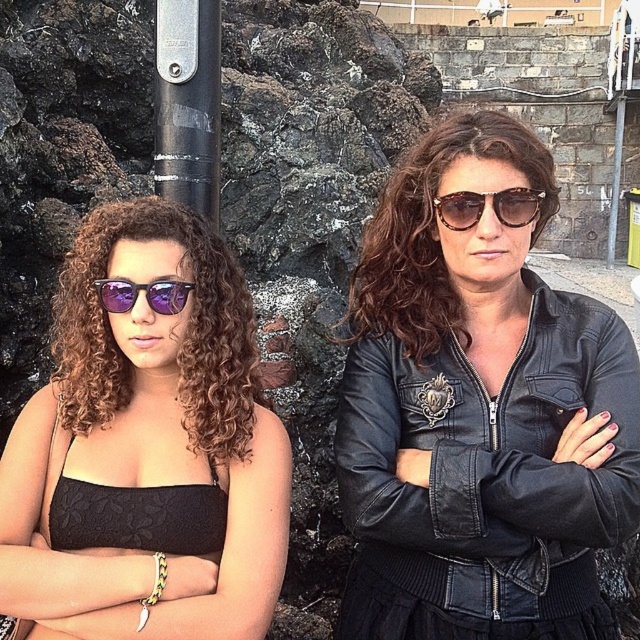
Describe the element at coordinates (433, 232) in the screenshot. I see `leather jacket at center` at that location.

Is leather jacket at center in front of purple reflective sunglasses at left?

No, leather jacket at center is behind purple reflective sunglasses at left.

Does point (394, 305) come farther from viewer compared to point (118, 291)?

Yes, it is.

In order to click on leather jacket at center in this screenshot , I will do `click(433, 232)`.

Between black leather jacket at center and purple reflective sunglasses at left, which one is positioned higher?

Positioned higher is purple reflective sunglasses at left.

Is point (524, 474) more distant than point (188, 285)?

No, (524, 474) is closer to viewer.

Does point (444, 609) lie in front of point (128, 280)?

No, it is behind (128, 280).

Where is `black leather jacket at center`? black leather jacket at center is located at coordinates (486, 481).

Measure the distance between matte black top at center and purple reflective sunglasses at left.

matte black top at center and purple reflective sunglasses at left are 30.48 inches apart.

Looking at this image, does matte black top at center come behind purple reflective sunglasses at left?

No, matte black top at center is in front of purple reflective sunglasses at left.

Is point (241, 364) farther from camera compared to point (180, 305)?

That is True.

Locate an element on the screen. This screenshot has height=640, width=640. matte black top at center is located at coordinates (147, 451).